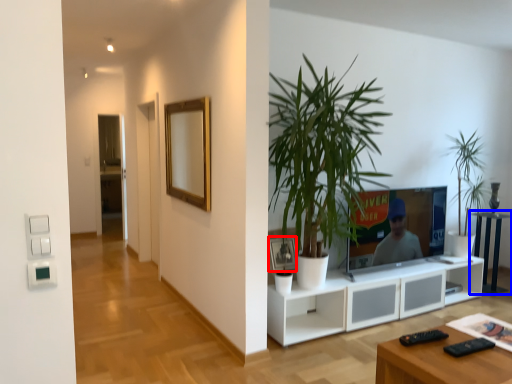
Question: Which object is closer to the camera taking this photo, picture frame (highlighted by a red box) or side table (highlighted by a blue box)?

Choices:
 (A) picture frame
 (B) side table

Answer: (A)